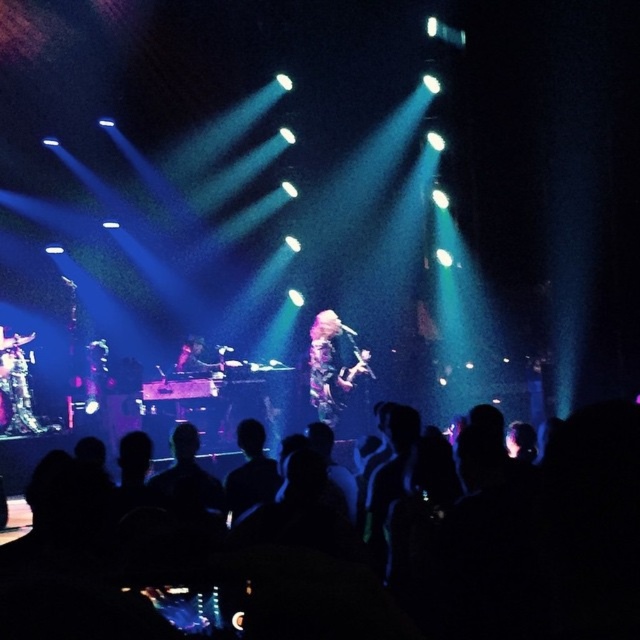
In the scene shown: Who is more distant from viewer, (480, 525) or (328, 342)?

Point (328, 342)

Is black silhouettes at lower center to the left of floral-patterned dress at center from the viewer's perspective?

Yes, black silhouettes at lower center is to the left of floral-patterned dress at center.

Between point (225, 564) and point (353, 378), which one is positioned behind?

Positioned behind is point (353, 378).

The width and height of the screenshot is (640, 640). Identify the location of black silhouettes at lower center. (554, 540).